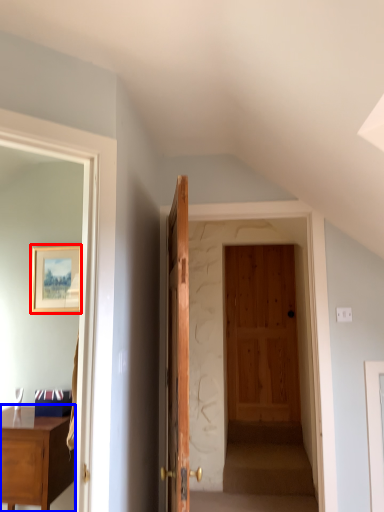
Question: Which object is further to the camera taking this photo, picture frame (highlighted by a red box) or desk (highlighted by a blue box)?

Choices:
 (A) picture frame
 (B) desk

Answer: (A)